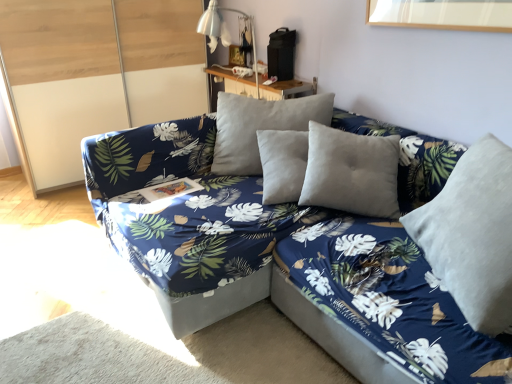
Question: Considering the relative sizes of metallic silver table lamp at upper center and wooden table at upper center in the image provided, is metallic silver table lamp at upper center wider than wooden table at upper center?

Choices:
 (A) no
 (B) yes

Answer: (B)

Question: Is metallic silver table lamp at upper center oriented away from wooden table at upper center?

Choices:
 (A) yes
 (B) no

Answer: (B)

Question: Is metallic silver table lamp at upper center taller than wooden table at upper center?

Choices:
 (A) no
 (B) yes

Answer: (B)

Question: From the image's perspective, is metallic silver table lamp at upper center located beneath wooden table at upper center?

Choices:
 (A) yes
 (B) no

Answer: (A)

Question: Is metallic silver table lamp at upper center thinner than wooden table at upper center?

Choices:
 (A) no
 (B) yes

Answer: (A)

Question: Is metallic silver table lamp at upper center to the left of wooden table at upper center from the viewer's perspective?

Choices:
 (A) no
 (B) yes

Answer: (B)

Question: Can you confirm if wooden table at upper center is smaller than blue fabric couch at center?

Choices:
 (A) no
 (B) yes

Answer: (B)

Question: Is wooden table at upper center with blue fabric couch at center?

Choices:
 (A) no
 (B) yes

Answer: (A)

Question: From the image's perspective, is wooden table at upper center located above blue fabric couch at center?

Choices:
 (A) no
 (B) yes

Answer: (B)

Question: Is wooden table at upper center not inside blue fabric couch at center?

Choices:
 (A) yes
 (B) no

Answer: (A)

Question: Does wooden table at upper center have a greater height compared to blue fabric couch at center?

Choices:
 (A) no
 (B) yes

Answer: (A)

Question: From the image's perspective, is wooden table at upper center located beneath blue fabric couch at center?

Choices:
 (A) yes
 (B) no

Answer: (B)

Question: Are velvet gray pillow at right and transparent glass door at left far apart?

Choices:
 (A) yes
 (B) no

Answer: (A)